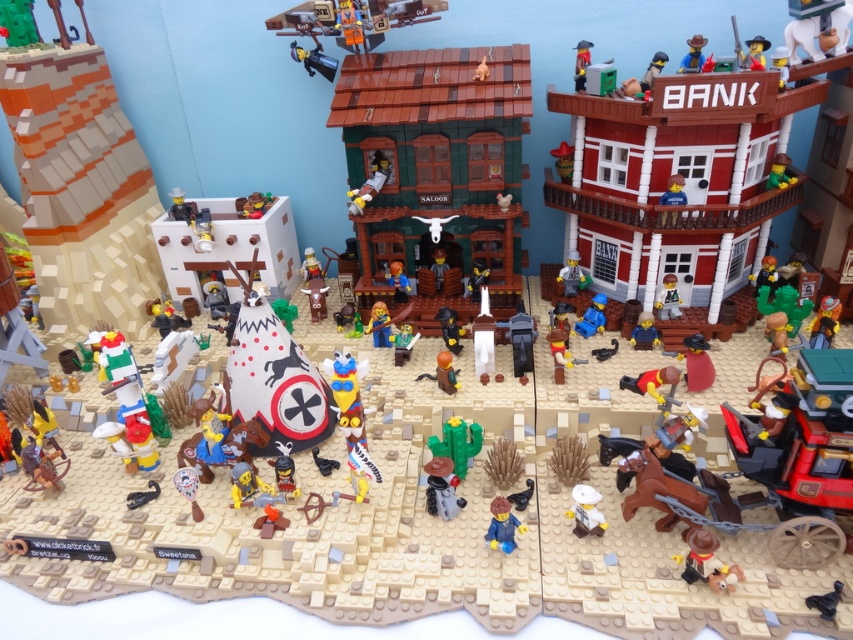
Is matte red cowboy hat at center below green matte shield at center?

Yes, matte red cowboy hat at center is below green matte shield at center.

Between point (665, 376) and point (402, 337), which one is positioned in front?

Point (665, 376) is in front.

Which is behind, point (654, 376) or point (403, 332)?

Point (403, 332)

At what (x,y) coordinates should I click in order to perform the action: click on matte red cowboy hat at center. Please return your answer as a coordinate pair (x, y). This screenshot has width=853, height=640. Looking at the image, I should click on (650, 381).

Can you confirm if smooth red brick bank at upper right is positioned to the left of light brown plastic figure at center?

No, smooth red brick bank at upper right is not to the left of light brown plastic figure at center.

Measure the distance between smooth red brick bank at upper right and light brown plastic figure at center.

smooth red brick bank at upper right and light brown plastic figure at center are 1.26 meters apart from each other.

Locate an element on the screen. Image resolution: width=853 pixels, height=640 pixels. smooth red brick bank at upper right is located at coordinates (679, 177).

Can you confirm if matte black gun at center is positioned to the right of smooth yellow cowboy hat at center?

Indeed, matte black gun at center is positioned on the right side of smooth yellow cowboy hat at center.

Between matte black gun at center and smooth yellow cowboy hat at center, which one has less height?

smooth yellow cowboy hat at center

Is point (433, 472) farther from viewer compared to point (373, 317)?

That is False.

Locate an element on the screen. matte black gun at center is located at coordinates (442, 488).